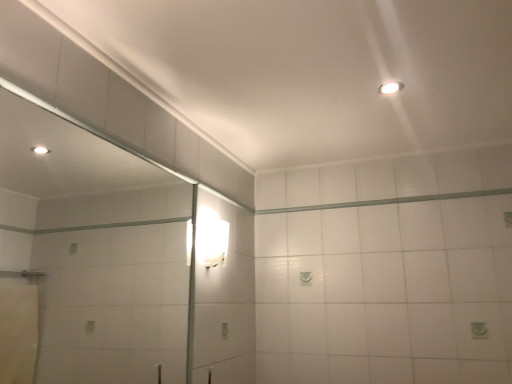
Question: Can you confirm if white glossy beam at upper center is thinner than white glossy wall sconce at upper center, which is counted as the second light fixture, starting from the top?

Choices:
 (A) no
 (B) yes

Answer: (B)

Question: Is white glossy beam at upper center at the left side of white glossy wall sconce at upper center, which is counted as the 1th light fixture, starting from the left?

Choices:
 (A) no
 (B) yes

Answer: (A)

Question: Can we say white glossy beam at upper center lies outside white glossy wall sconce at upper center, which is counted as the second light fixture, starting from the front?

Choices:
 (A) yes
 (B) no

Answer: (A)

Question: Does white glossy beam at upper center appear on the right side of white glossy wall sconce at upper center, the first light fixture from the back?

Choices:
 (A) yes
 (B) no

Answer: (A)

Question: Would you say white glossy beam at upper center is a long distance from white glossy wall sconce at upper center, which is counted as the second light fixture, starting from the front?

Choices:
 (A) yes
 (B) no

Answer: (B)

Question: Do you think clear glass mirror at left is within white glossy wall sconce at upper center, which is counted as the second light fixture, starting from the front, or outside of it?

Choices:
 (A) outside
 (B) inside

Answer: (A)

Question: From a real-world perspective, is clear glass mirror at left positioned above or below white glossy wall sconce at upper center, the 1th light fixture ordered from the bottom?

Choices:
 (A) above
 (B) below

Answer: (B)

Question: Considering the positions of clear glass mirror at left and white glossy wall sconce at upper center, which is counted as the second light fixture, starting from the top, in the image, is clear glass mirror at left wider or thinner than white glossy wall sconce at upper center, which is counted as the second light fixture, starting from the top,?

Choices:
 (A) thin
 (B) wide

Answer: (A)

Question: Is clear glass mirror at left to the left or to the right of white glossy wall sconce at upper center, which is counted as the 1th light fixture, starting from the left, in the image?

Choices:
 (A) left
 (B) right

Answer: (A)

Question: Do you think white glossy beam at upper center is within white glossy wall sconce at upper center, which is counted as the second light fixture, starting from the front, or outside of it?

Choices:
 (A) outside
 (B) inside

Answer: (A)

Question: From the image's perspective, relative to white glossy wall sconce at upper center, the first light fixture from the back, is white glossy beam at upper center above or below?

Choices:
 (A) below
 (B) above

Answer: (B)

Question: Is point (392, 203) closer or farther from the camera than point (205, 226)?

Choices:
 (A) farther
 (B) closer

Answer: (A)

Question: From a real-world perspective, relative to white glossy wall sconce at upper center, which is counted as the second light fixture, starting from the top, is white glossy beam at upper center vertically above or below?

Choices:
 (A) above
 (B) below

Answer: (A)

Question: Looking at the image, does white glossy wall sconce at upper center, the first light fixture from the back, seem bigger or smaller compared to clear glass mirror at left?

Choices:
 (A) big
 (B) small

Answer: (B)

Question: Based on their positions, is white glossy wall sconce at upper center, which is counted as the second light fixture, starting from the top, located to the left or right of clear glass mirror at left?

Choices:
 (A) right
 (B) left

Answer: (A)